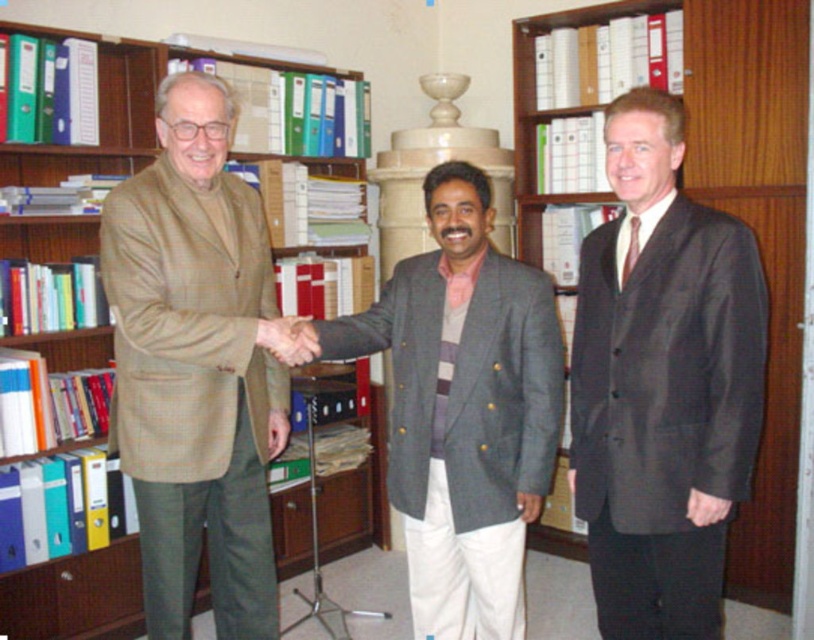
Question: Which of the following is the closest to the observer?

Choices:
 (A) (510, 538)
 (B) (283, 326)
 (C) (762, 316)
 (D) (142, 381)

Answer: (C)

Question: Does dark gray suit at center come behind gray woolen blazer at center?

Choices:
 (A) yes
 (B) no

Answer: (B)

Question: From the image, what is the correct spatial relationship of dark gray suit at center in relation to gray woolen blazer at center?

Choices:
 (A) below
 (B) above

Answer: (B)

Question: Which of the following is the closest to the observer?

Choices:
 (A) (186, 618)
 (B) (278, 355)

Answer: (B)

Question: Which object is positioned closest to the brown leather hand at center?

Choices:
 (A) gray woolen blazer at center
 (B) beige woolen coat at left

Answer: (B)

Question: Is dark gray suit at center wider than gray woolen blazer at center?

Choices:
 (A) no
 (B) yes

Answer: (A)